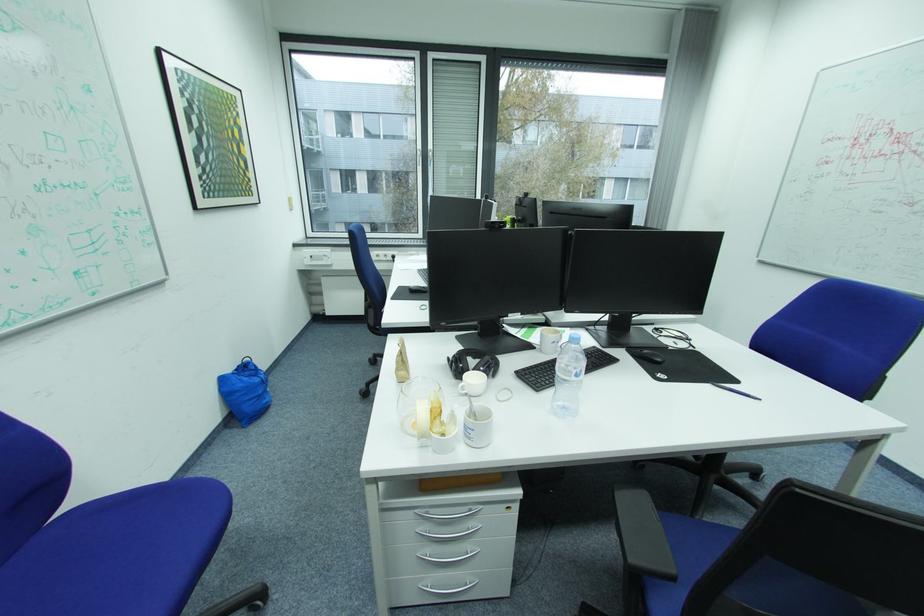
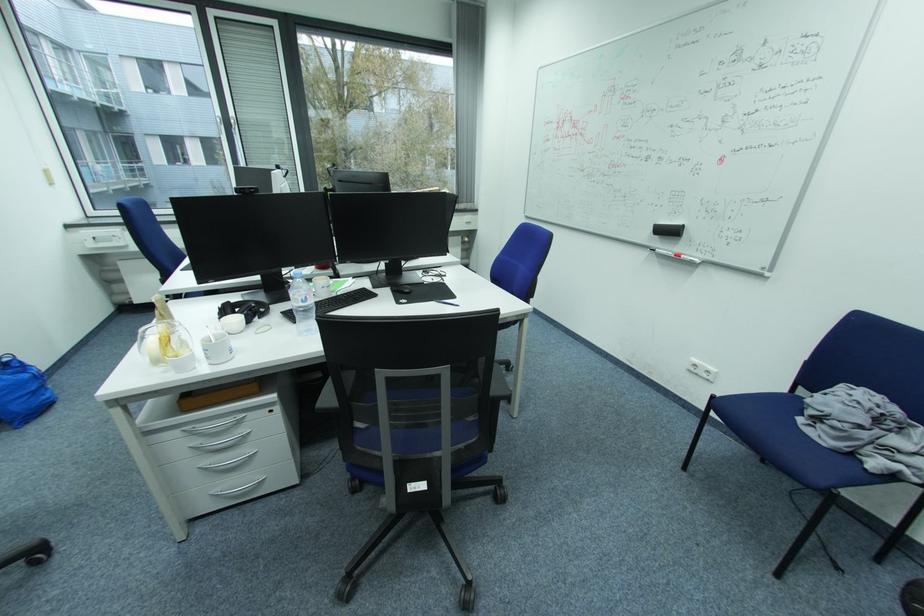
The point at (439, 557) is marked in the first image. Where is the corresponding point in the second image?

(219, 466)